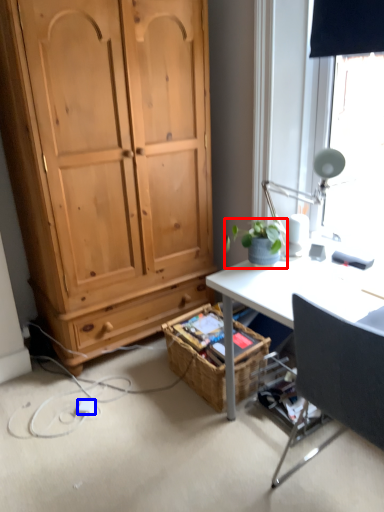
Question: Among these objects, which one is nearest to the camera, houseplant (highlighted by a red box) or power outlet (highlighted by a blue box)?

Choices:
 (A) houseplant
 (B) power outlet

Answer: (A)